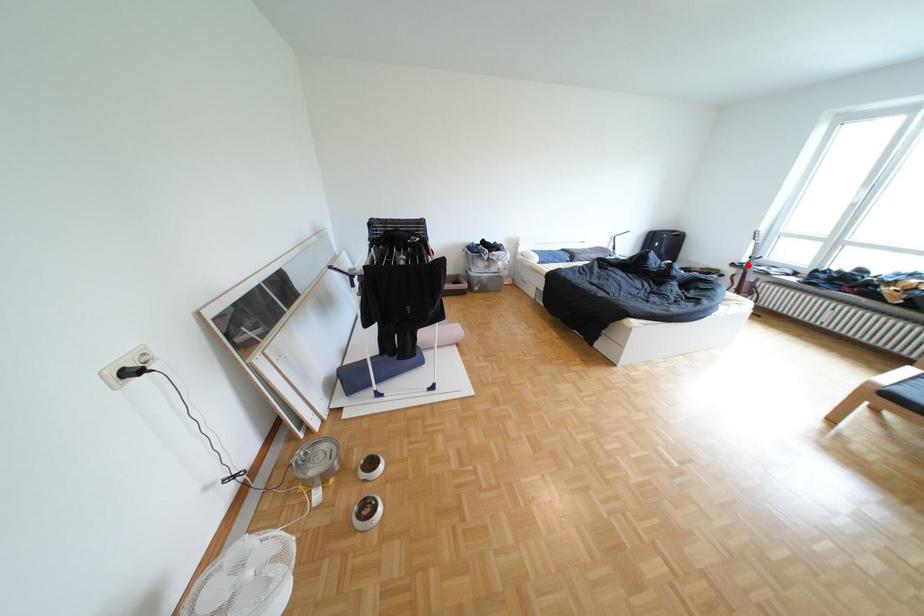
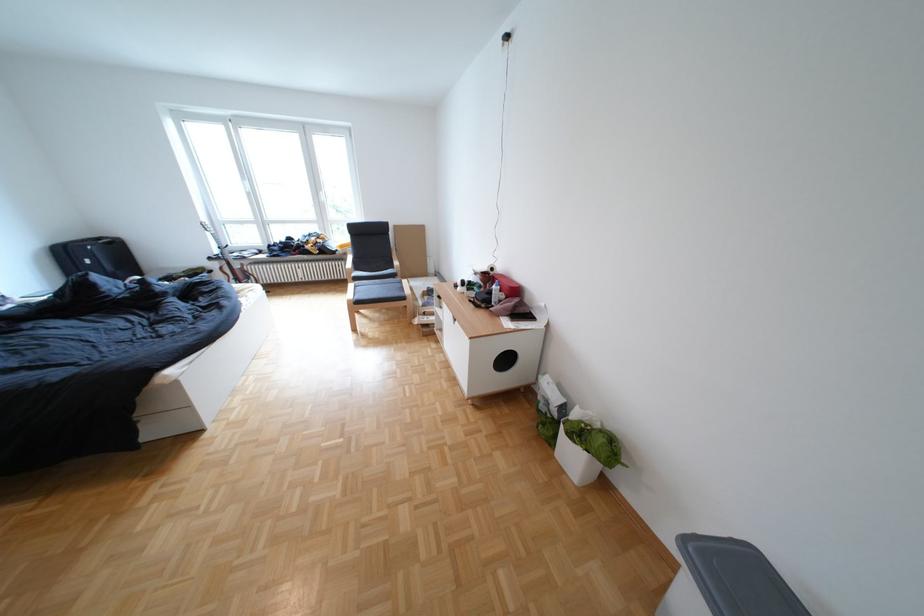
Locate, in the second image, the point that corresponds to the highlighted location in the first image.

(225, 259)